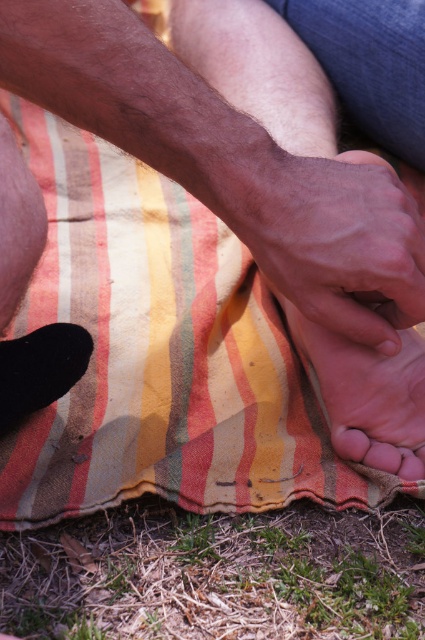
You are a physical therapist observing a patient who has a pink smooth foot at lower center and a smooth pink toe at lower right. Which body part is closer to the ground?

The pink smooth foot at lower center is closer to the ground because it is taller than the smooth pink toe at lower right, indicating it is positioned lower.

You are a photographer trying to capture the pink soft skin at center and the green grass at lower center in a single shot. Which object should you focus on first to ensure both are in frame?

The green grass at lower center is in front of the pink soft skin at center, so you should focus on the green grass at lower center first to ensure both are in frame.

You are a photographer trying to capture the pink soft skin at center and the green grass at lower center in the same frame. Based on their sizes, which one would you need to zoom in more to focus on?

The pink soft skin at center is smaller than the green grass at lower center, so you would need to zoom in more to focus on the pink soft skin at center.